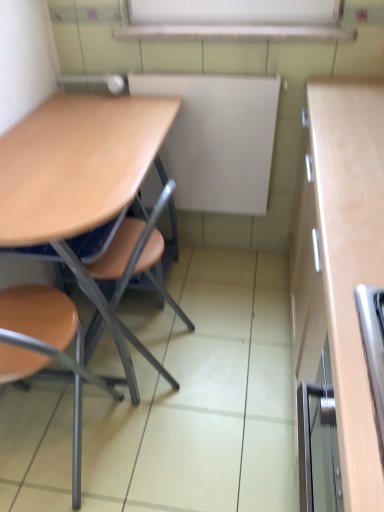
Question: Is brown matte chair at left outside white matte board at center?

Choices:
 (A) no
 (B) yes

Answer: (B)

Question: Does brown matte chair at left come behind white matte board at center?

Choices:
 (A) yes
 (B) no

Answer: (B)

Question: Does brown matte chair at left have a larger size compared to white matte board at center?

Choices:
 (A) yes
 (B) no

Answer: (A)

Question: Can you confirm if brown matte chair at left is taller than white matte board at center?

Choices:
 (A) no
 (B) yes

Answer: (B)

Question: From the image's perspective, does brown matte chair at left appear higher than white matte board at center?

Choices:
 (A) no
 (B) yes

Answer: (A)

Question: Considering the relative sizes of brown matte chair at left and white matte board at center in the image provided, is brown matte chair at left smaller than white matte board at center?

Choices:
 (A) no
 (B) yes

Answer: (A)

Question: Is the position of white matte board at center more distant than that of brown matte chair at left?

Choices:
 (A) yes
 (B) no

Answer: (A)

Question: From the image's perspective, does white matte board at center appear higher than brown matte chair at left?

Choices:
 (A) yes
 (B) no

Answer: (A)

Question: Can you confirm if white matte board at center is shorter than brown matte chair at left?

Choices:
 (A) no
 (B) yes

Answer: (B)

Question: Is brown matte chair at left at the back of white matte board at center?

Choices:
 (A) no
 (B) yes

Answer: (A)

Question: Can you see white matte board at center touching brown matte chair at left?

Choices:
 (A) no
 (B) yes

Answer: (A)

Question: From a real-world perspective, is white matte board at center below brown matte chair at left?

Choices:
 (A) yes
 (B) no

Answer: (B)

Question: Does matte wood desk at left touch brown matte chair at left?

Choices:
 (A) no
 (B) yes

Answer: (A)